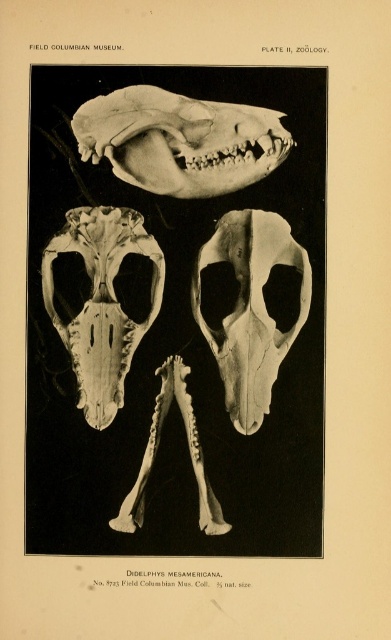
Can you confirm if translucent bone skull at upper center is positioned above white bone skull at center?

Yes, translucent bone skull at upper center is above white bone skull at center.

Describe the element at coordinates (179, 140) in the screenshot. I see `translucent bone skull at upper center` at that location.

Is point (215, 106) positioned in front of point (240, 349)?

Yes, it is.

The width and height of the screenshot is (391, 640). In order to click on translucent bone skull at upper center in this screenshot , I will do `click(179, 140)`.

Between point (290, 346) and point (53, 317), which one is positioned in front?

Point (53, 317) is more forward.

Between point (254, 385) and point (118, 394), which one is positioned behind?

Point (254, 385)

Find the location of a particular element. white bone skull at center is located at coordinates (251, 308).

Between point (240, 154) and point (46, 288), which one is positioned in front?

Point (240, 154) is more forward.

Between translucent bone skull at upper center and translucent bone skull at center, which one has more height?

translucent bone skull at center

Identify the location of translucent bone skull at upper center. The height and width of the screenshot is (640, 391). (179, 140).